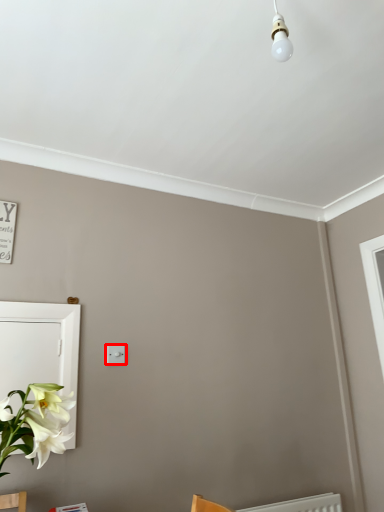
Question: From the image's perspective, considering the relative positions of light switch (annotated by the red box) and medicine cabinet in the image provided, where is light switch (annotated by the red box) located with respect to the staircase?

Choices:
 (A) below
 (B) above

Answer: (B)